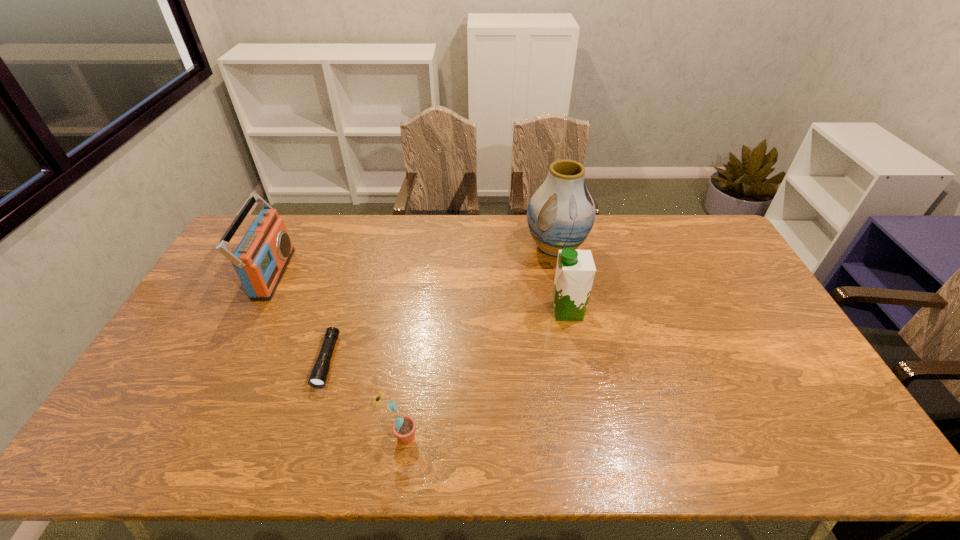
Locate an element on the screen. The width and height of the screenshot is (960, 540). vacant region at the near edge of the desktop is located at coordinates (490, 462).

Image resolution: width=960 pixels, height=540 pixels. Identify the location of vacant point at the right edge. [759, 356].

Identify the location of vacant space that's between the soya milk and the leftmost object. (420, 293).

Locate an element on the screen. free point between the fourth farthest object and the vase is located at coordinates (442, 304).

I want to click on vacant space that is in between the tallest object and the radio receiver, so click(x=414, y=260).

Locate an element on the screen. Image resolution: width=960 pixels, height=540 pixels. free point between the leftmost object and the third object from left to right is located at coordinates (336, 355).

Where is `empty space between the tallest object and the nearest object`? This screenshot has width=960, height=540. empty space between the tallest object and the nearest object is located at coordinates (478, 342).

You are a GUI agent. You are given a task and a screenshot of the screen. Output one action in this format:
    pyautogui.click(x=<x>, y=<y>)
    Task: Click on the empty location between the second object from left to right and the soya milk
    Image resolution: width=960 pixels, height=540 pixels.
    Given the screenshot: What is the action you would take?
    pyautogui.click(x=447, y=336)

Where is `empty space between the soya milk and the sunflower`? empty space between the soya milk and the sunflower is located at coordinates (484, 374).

The width and height of the screenshot is (960, 540). In order to click on object that is the second closest to the vase in this screenshot , I will do `click(318, 377)`.